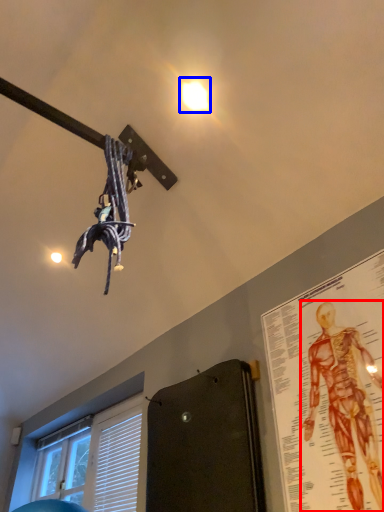
Question: Which of the following is the farthest to the observer, person (highlighted by a red box) or droplight (highlighted by a blue box)?

Choices:
 (A) person
 (B) droplight

Answer: (B)